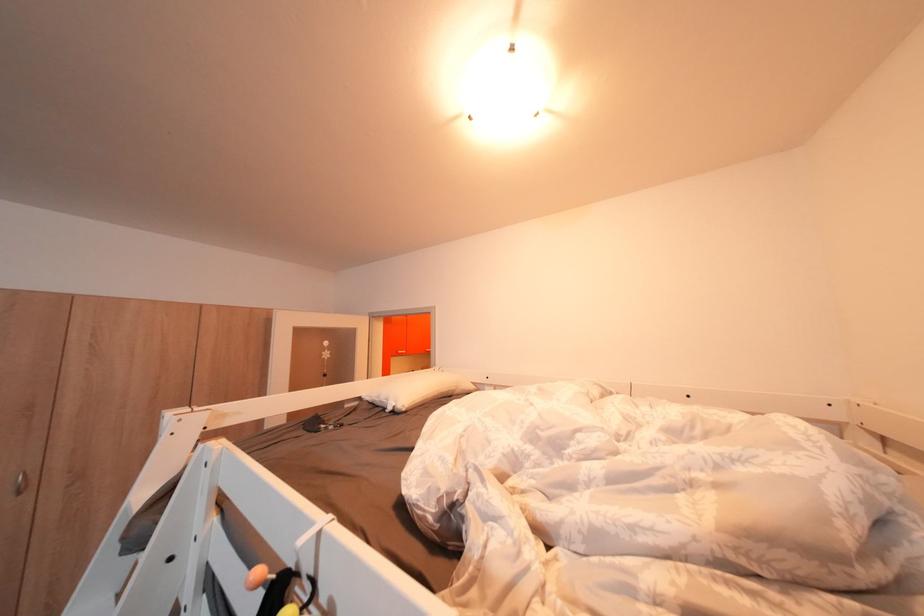
The image size is (924, 616). What do you see at coordinates (179, 552) in the screenshot?
I see `a white bed rail` at bounding box center [179, 552].